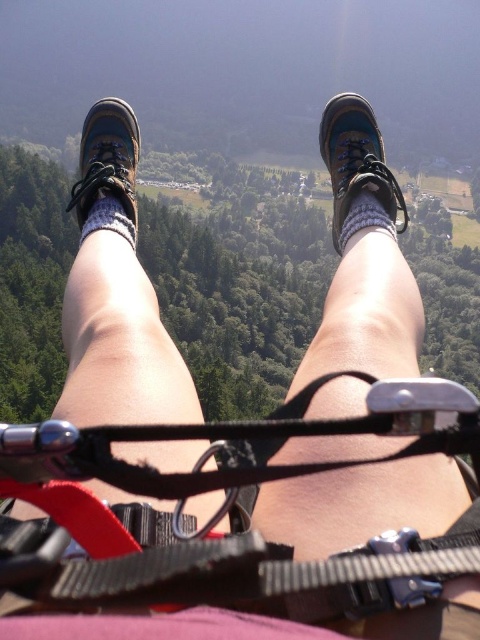
Is brown leather boot at center positioned in front of suede sock at center?

No, brown leather boot at center is behind suede sock at center.

Which is in front, point (122, 147) or point (130, 236)?

Positioned in front is point (130, 236).

This screenshot has height=640, width=480. In order to click on brown leather boot at center in this screenshot , I will do `click(107, 157)`.

Who is more distant from viewer, (144, 339) or (360, 195)?

Positioned behind is point (360, 195).

Is point (132, 109) positioned before point (349, 212)?

No.

Identify the location of matte black shoe at left. This screenshot has height=640, width=480. click(119, 342).

Is black nylon strap at center bigger than brown leather boot at center?

No, black nylon strap at center is not bigger than brown leather boot at center.

Which is in front, point (446, 547) or point (83, 156)?

Point (446, 547) is more forward.

Is point (324, 570) behind point (91, 147)?

That is False.

Image resolution: width=480 pixels, height=640 pixels. I want to click on black nylon strap at center, so click(x=229, y=509).